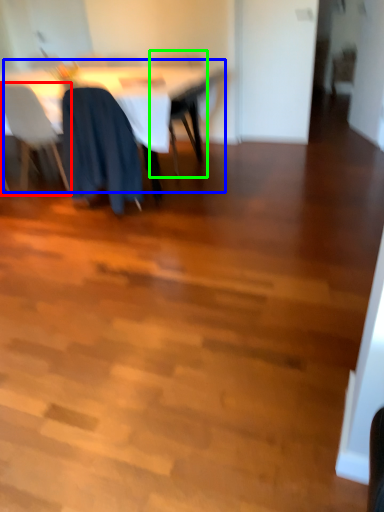
Question: Considering the real-world distances, which object is farthest from chair (highlighted by a red box)? table (highlighted by a blue box) or chair (highlighted by a green box)?

Choices:
 (A) table
 (B) chair

Answer: (B)